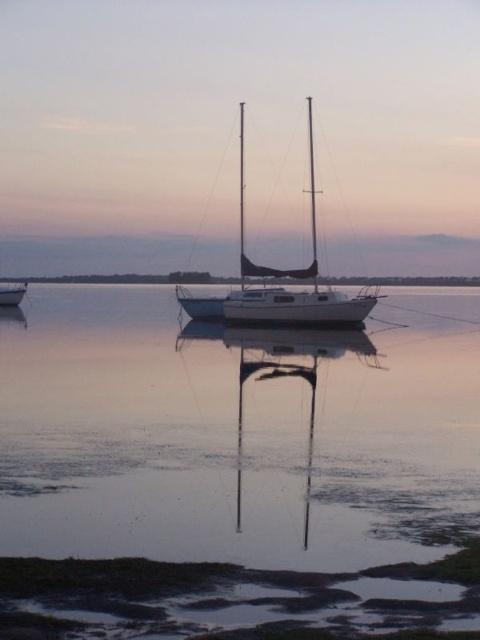
Question: Is white glossy sailboat at center to the left of white glossy boat at left from the viewer's perspective?

Choices:
 (A) yes
 (B) no

Answer: (B)

Question: Is smooth water at center thinner than white glossy sailboat at center?

Choices:
 (A) yes
 (B) no

Answer: (B)

Question: Does smooth water at center have a smaller size compared to white glossy sailboat at center?

Choices:
 (A) no
 (B) yes

Answer: (B)

Question: Estimate the real-world distances between objects in this image. Which object is closer to the smooth water at center?

Choices:
 (A) white glossy sailboat at center
 (B) white glossy boat at left

Answer: (B)

Question: Among these points, which one is nearest to the camera?

Choices:
 (A) (2, 289)
 (B) (313, 259)
 (C) (335, 396)

Answer: (C)

Question: Which point is farther to the camera?

Choices:
 (A) (240, 278)
 (B) (16, 288)
 (C) (307, 477)

Answer: (B)